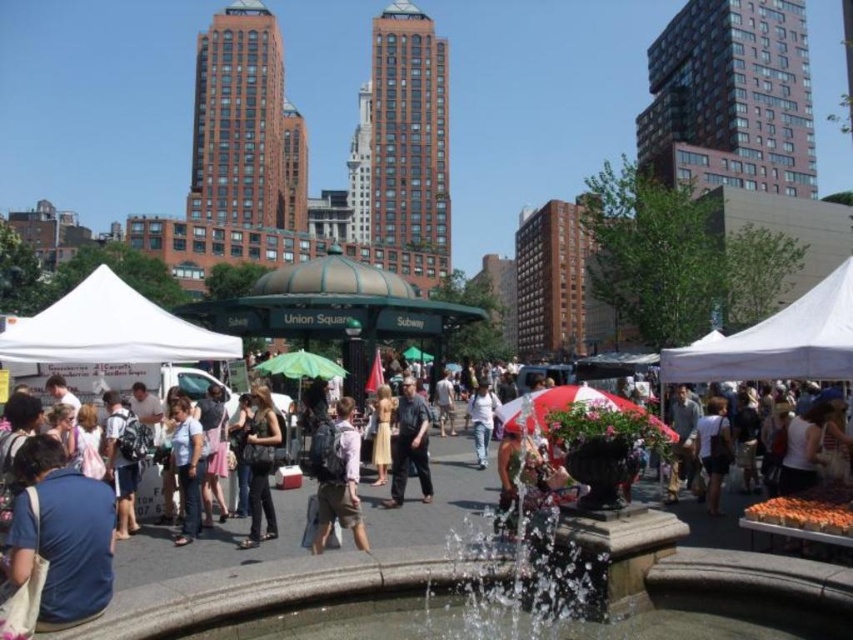
Question: Considering the real-world distances, which object is closest to the denim pants at center?

Choices:
 (A) white cotton shirt at center
 (B) light blue shirt at center
 (C) white fabric tent at center
 (D) matte black backpack at center

Answer: (D)

Question: Does matte blue shirt at lower left appear on the right side of white fabric canopy at left?

Choices:
 (A) yes
 (B) no

Answer: (A)

Question: Which object is closer to the camera taking this photo?

Choices:
 (A) white cotton shirt at center
 (B) matte black backpack at center
 (C) light blue shirt at center
 (D) white fabric canopy at upper right

Answer: (D)

Question: Which point is farther to the camera?

Choices:
 (A) (138, 609)
 (B) (221, 342)

Answer: (B)

Question: Does matte blue shirt at lower left have a greater width compared to light blue shirt at center?

Choices:
 (A) yes
 (B) no

Answer: (B)

Question: Does white fabric canopy at left lie in front of dark gray shirt at center?

Choices:
 (A) yes
 (B) no

Answer: (A)